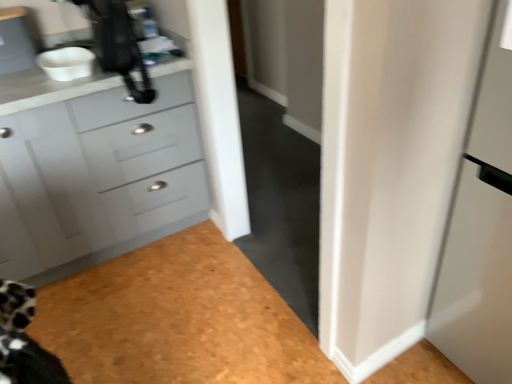
Where is `matte gray cabinet at upper left`? matte gray cabinet at upper left is located at coordinates (15, 41).

Find the location of a particular element. Image resolution: width=512 pixels, height=384 pixels. matte gray cabinet at upper left is located at coordinates (15, 41).

Consider the image. From the image's perspective, is black plastic coffee machine at upper left located above or below matte gray cabinet at left?

black plastic coffee machine at upper left is above matte gray cabinet at left.

Based on the photo, who is shorter, black plastic coffee machine at upper left or matte gray cabinet at left?

black plastic coffee machine at upper left is shorter.

Considering the relative positions of black plastic coffee machine at upper left and matte gray cabinet at left in the image provided, is black plastic coffee machine at upper left to the right of matte gray cabinet at left from the viewer's perspective?

Indeed, black plastic coffee machine at upper left is positioned on the right side of matte gray cabinet at left.

Where is `the chest of drawers beneath the black plastic coffee machine at upper left (from a real-world perspective)`? Image resolution: width=512 pixels, height=384 pixels. the chest of drawers beneath the black plastic coffee machine at upper left (from a real-world perspective) is located at coordinates (100, 177).

Would you say white glossy door at right is a long distance from matte gray cabinet at upper left?

Absolutely, white glossy door at right is distant from matte gray cabinet at upper left.

Is white glossy door at right oriented towards matte gray cabinet at upper left?

No.

Based on the photo, between white glossy door at right and matte gray cabinet at upper left, which one has larger size?

→ white glossy door at right is bigger.

Is point (470, 355) in front of point (10, 57)?

Yes, it is in front of point (10, 57).

Which is further, (452, 268) or (58, 69)?

Point (58, 69)

Consider the image. From a real-world perspective, who is located lower, white glossy door at right or white matte bowl at upper left?

white glossy door at right, from a real-world perspective.

Locate an element on the screen. screen door on the right of white matte bowl at upper left is located at coordinates (481, 227).

Which of these two, white glossy door at right or white matte bowl at upper left, is thinner?

Thinner between the two is white matte bowl at upper left.

In the scene shown: Is black plastic coffee machine at upper left taller or shorter than matte gray cabinet at upper left?

black plastic coffee machine at upper left is taller than matte gray cabinet at upper left.

Where is `cabinetry above the black plastic coffee machine at upper left (from the image's perspective)`? The width and height of the screenshot is (512, 384). cabinetry above the black plastic coffee machine at upper left (from the image's perspective) is located at coordinates (15, 41).

Would you say black plastic coffee machine at upper left is inside or outside matte gray cabinet at upper left?

black plastic coffee machine at upper left is not inside matte gray cabinet at upper left, it's outside.

At what (x,y) coordinates should I click in order to perform the action: click on coffee machine that appears above the white matte bowl at upper left (from the image's perspective). Please return your answer as a coordinate pair (x, y). The width and height of the screenshot is (512, 384). Looking at the image, I should click on (118, 45).

Can you confirm if white matte bowl at upper left is shorter than black plastic coffee machine at upper left?

Yes.

What's the angular difference between white matte bowl at upper left and black plastic coffee machine at upper left's facing directions?

There is a 90.4-degree angle between the facing directions of white matte bowl at upper left and black plastic coffee machine at upper left.

Who is smaller, white matte bowl at upper left or black plastic coffee machine at upper left?

Smaller between the two is white matte bowl at upper left.

Is white matte bowl at upper left far away from white glossy door at right?

Yes, white matte bowl at upper left and white glossy door at right are quite far apart.

Which of these two, white matte bowl at upper left or white glossy door at right, stands shorter?

white matte bowl at upper left is shorter.

In the scene shown: Is white matte bowl at upper left in front of white glossy door at right?

No, it is behind white glossy door at right.

Looking at this image, is white matte bowl at upper left oriented away from white glossy door at right?

white matte bowl at upper left does not have its back to white glossy door at right.

In the image, is white glossy door at right positioned in front of or behind matte gray cabinet at left?

white glossy door at right is positioned closer to the viewer than matte gray cabinet at left.

Looking at the image, does white glossy door at right seem bigger or smaller compared to matte gray cabinet at left?

white glossy door at right is smaller than matte gray cabinet at left.

Could matte gray cabinet at left be considered to be inside white glossy door at right?

Definitely not — matte gray cabinet at left is not inside white glossy door at right.

From a real-world perspective, is white glossy door at right positioned above or below matte gray cabinet at left?

In terms of real-world spatial position, white glossy door at right is above matte gray cabinet at left.

I want to click on coffee machine behind the matte gray cabinet at left, so click(118, 45).

This screenshot has width=512, height=384. In order to click on screen door in front of the matte gray cabinet at upper left in this screenshot , I will do `click(481, 227)`.

Based on the photo, looking at the image, which one is located further to white matte bowl at upper left, matte gray cabinet at left or white glossy door at right?

white glossy door at right lies further to white matte bowl at upper left than the other object.

Looking at the image, which one is located closer to white glossy door at right, matte gray cabinet at upper left or matte gray cabinet at left?

matte gray cabinet at left lies closer to white glossy door at right than the other object.

Based on their spatial positions, is white matte bowl at upper left or black plastic coffee machine at upper left closer to matte gray cabinet at left?

black plastic coffee machine at upper left lies closer to matte gray cabinet at left than the other object.

When comparing their distances from matte gray cabinet at upper left, does black plastic coffee machine at upper left or white glossy door at right seem further?

The object further to matte gray cabinet at upper left is white glossy door at right.

From the picture: Based on their spatial positions, is matte gray cabinet at upper left or white matte bowl at upper left closer to matte gray cabinet at left?

Among the two, white matte bowl at upper left is located nearer to matte gray cabinet at left.

When comparing their distances from black plastic coffee machine at upper left, does matte gray cabinet at left or white matte bowl at upper left seem further?

The object further to black plastic coffee machine at upper left is matte gray cabinet at left.

Based on their spatial positions, is white matte bowl at upper left or white glossy door at right closer to matte gray cabinet at left?

white matte bowl at upper left is positioned closer to the anchor matte gray cabinet at left.

From the image, which object appears to be farther from white matte bowl at upper left, matte gray cabinet at left or black plastic coffee machine at upper left?

matte gray cabinet at left.

Locate an element on the screen. Image resolution: width=512 pixels, height=384 pixels. coffee machine between white matte bowl at upper left and white glossy door at right from left to right is located at coordinates (118, 45).

You are a GUI agent. You are given a task and a screenshot of the screen. Output one action in this format:
    pyautogui.click(x=<x>, y=<y>)
    Task: Click on the sink between matte gray cabinet at upper left and matte gray cabinet at left vertically
    
    Given the screenshot: What is the action you would take?
    click(x=67, y=63)

The width and height of the screenshot is (512, 384). What are the coordinates of `sink between black plastic coffee machine at upper left and matte gray cabinet at left in the vertical direction` in the screenshot? It's located at (67, 63).

Locate an element on the screen. coffee machine between matte gray cabinet at upper left and matte gray cabinet at left vertically is located at coordinates (118, 45).